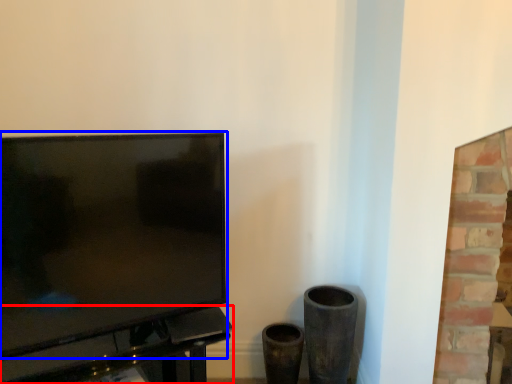
Question: Which object appears farthest to the camera in this image, table (highlighted by a red box) or television (highlighted by a blue box)?

Choices:
 (A) table
 (B) television

Answer: (A)